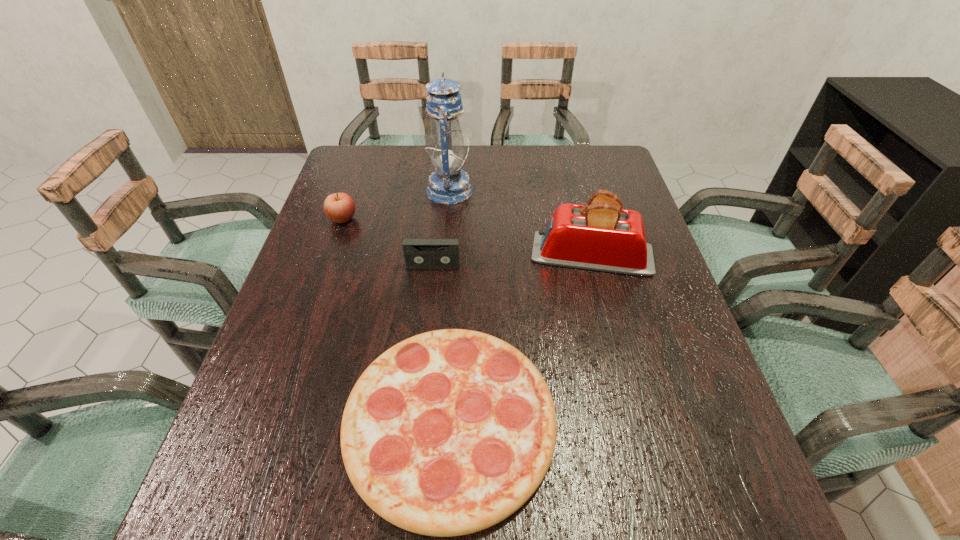
This screenshot has height=540, width=960. Find the location of `free space at the near left corner of the desktop`. free space at the near left corner of the desktop is located at coordinates (229, 512).

Find the location of a particular element. Image resolution: width=960 pixels, height=540 pixels. vacant space at the far right corner is located at coordinates (607, 164).

Where is `vacant space that is in between the leftmost object and the tallest object`? This screenshot has width=960, height=540. vacant space that is in between the leftmost object and the tallest object is located at coordinates (396, 205).

The height and width of the screenshot is (540, 960). Identify the location of empty space that is in between the videotape and the lantern. (442, 228).

At what (x,y) coordinates should I click in order to perform the action: click on free space that is in between the lantern and the videotape. Please return your answer as a coordinate pair (x, y). Image resolution: width=960 pixels, height=540 pixels. Looking at the image, I should click on (442, 228).

Locate an element on the screen. The height and width of the screenshot is (540, 960). vacant space in between the videotape and the apple is located at coordinates pos(388,242).

Image resolution: width=960 pixels, height=540 pixels. In order to click on free point between the tallest object and the videotape in this screenshot , I will do `click(442, 228)`.

At what (x,y) coordinates should I click in order to perform the action: click on unoccupied position between the second tallest object and the nearest object. Please return your answer as a coordinate pair (x, y). Image resolution: width=960 pixels, height=540 pixels. Looking at the image, I should click on (521, 338).

This screenshot has height=540, width=960. I want to click on vacant space in between the fourth nearest object and the pizza, so (396, 320).

Where is `free space that is in between the toaster and the nearest object`? The image size is (960, 540). free space that is in between the toaster and the nearest object is located at coordinates (521, 338).